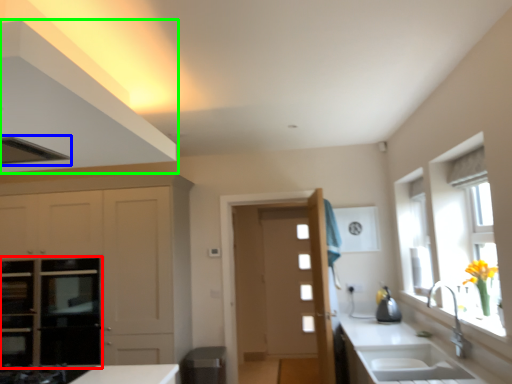
Question: Which is nearer to the oven (highlighted by a red box)? exhaust hood (highlighted by a blue box) or cabinetry (highlighted by a green box).

Choices:
 (A) exhaust hood
 (B) cabinetry

Answer: (A)